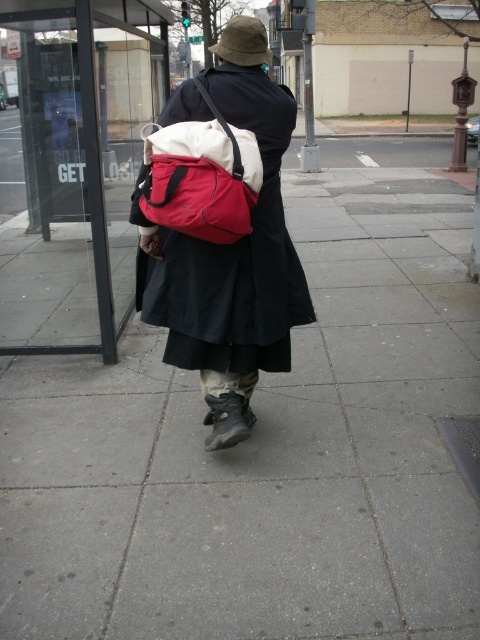
Is transparent glass bus stop at upper center above black matte robe at center?

Yes.

Does transparent glass bus stop at upper center lie in front of black matte robe at center?

No.

Find the location of a particular element. transparent glass bus stop at upper center is located at coordinates (74, 168).

Where is `transparent glass bus stop at upper center`? transparent glass bus stop at upper center is located at coordinates (74, 168).

Does black matte robe at center appear over matte nylon backpack at center?

No.

Who is taller, black matte robe at center or matte nylon backpack at center?

Standing taller between the two is black matte robe at center.

Does point (282, 204) come farther from viewer compared to point (180, 218)?

Yes, it is behind point (180, 218).

Find the location of a particular element. black matte robe at center is located at coordinates (232, 253).

Which is in front, point (80, 116) or point (219, 154)?

Point (219, 154) is in front.

Is point (67, 163) behind point (214, 150)?

Yes, point (67, 163) is behind point (214, 150).

Identify the location of transparent glass bus stop at upper center. (74, 168).